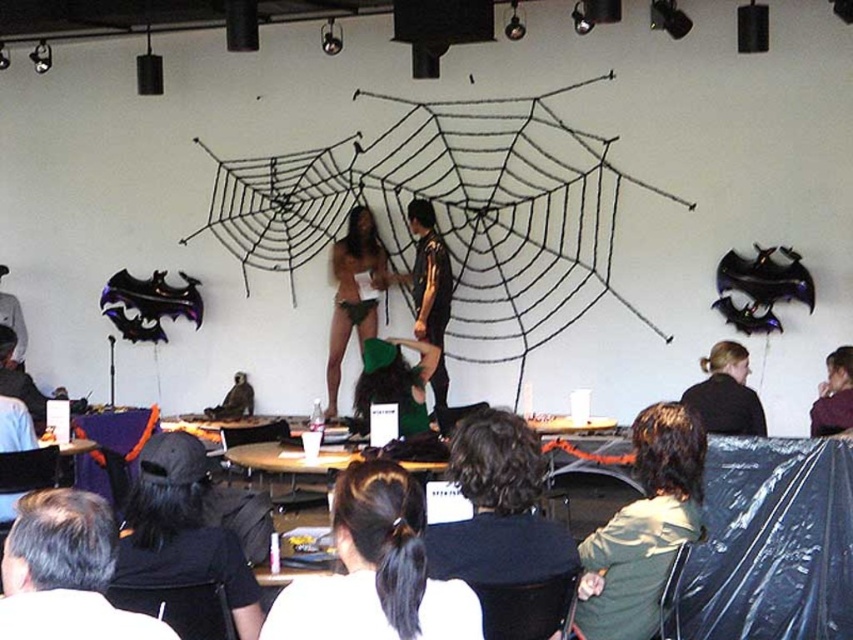
This screenshot has width=853, height=640. I want to click on black wire spider web at center, so click(x=450, y=211).

Is black wire spider web at center above black matte jacket at upper right?

Yes, black wire spider web at center is above black matte jacket at upper right.

Which is behind, point (572, 307) or point (711, 422)?

Point (572, 307)

This screenshot has height=640, width=853. What are the coordinates of `black wire spider web at center` in the screenshot? It's located at (450, 211).

Can you confirm if black wire spider web at center is positioned below matte black shirt at lower right?

No, black wire spider web at center is not below matte black shirt at lower right.

Is black wire spider web at center further to the viewer compared to matte black shirt at lower right?

Yes, it is behind matte black shirt at lower right.

You are a GUI agent. You are given a task and a screenshot of the screen. Output one action in this format:
    pyautogui.click(x=<x>, y=<y>)
    Task: Click on the black wire spider web at center
    The height and width of the screenshot is (640, 853).
    Given the screenshot: What is the action you would take?
    pyautogui.click(x=450, y=211)

Is green matte bikini bottom at center positioned behind black matte jacket at upper right?

Yes.

Between point (335, 298) and point (740, 429), which one is positioned in front?

Point (740, 429)

Identify the location of green matte bikini bottom at center. The image size is (853, 640). (352, 291).

At what (x,y) coordinates should I click in order to perform the action: click on green matte bikini bottom at center. Please return your answer as a coordinate pair (x, y). This screenshot has height=640, width=853. Looking at the image, I should click on (352, 291).